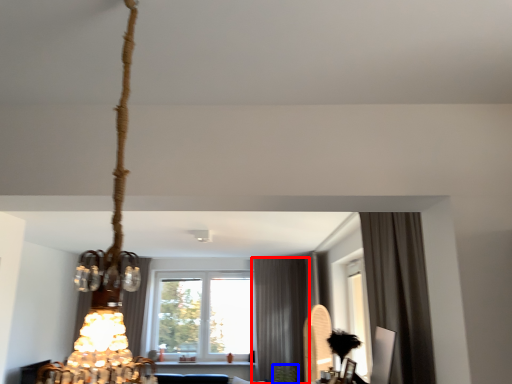
Question: Which object is further to the camera taking this photo, curtain (highlighted by a red box) or plant (highlighted by a blue box)?

Choices:
 (A) curtain
 (B) plant

Answer: (A)